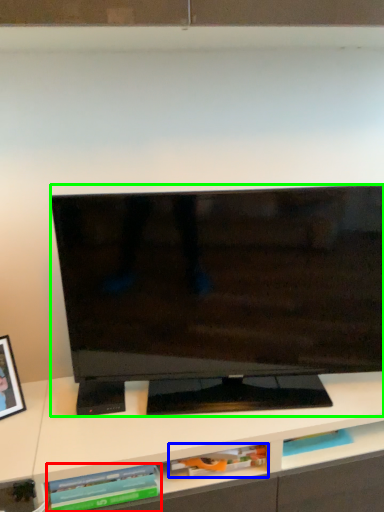
Question: Estimate the real-world distances between objects in this image. Which object is farther from book (highlighted by a red box), book (highlighted by a blue box) or television (highlighted by a green box)?

Choices:
 (A) book
 (B) television

Answer: (B)